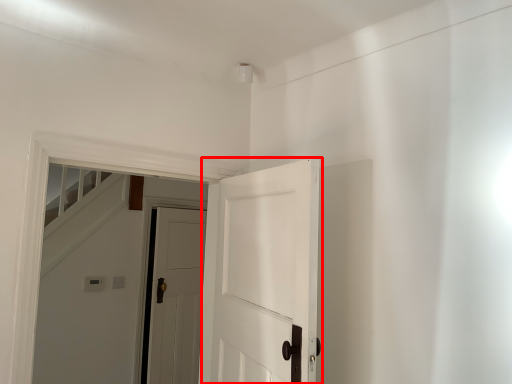
Question: From the image's perspective, considering the relative positions of door (annotated by the red box) and door in the image provided, where is door (annotated by the red box) located with respect to the staircase?

Choices:
 (A) above
 (B) below

Answer: (A)